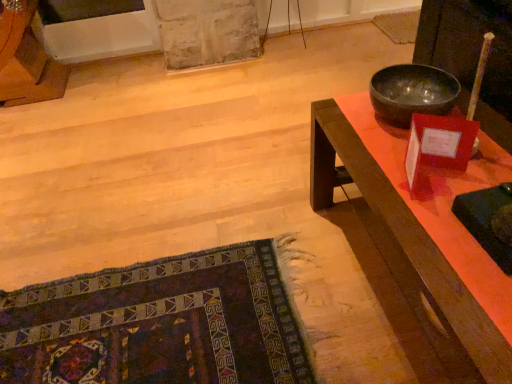
Question: Is dark woven rug at lower left not inside shiny metallic bowl at upper right?

Choices:
 (A) yes
 (B) no

Answer: (A)

Question: Considering the relative sizes of dark woven rug at lower left and shiny metallic bowl at upper right in the image provided, is dark woven rug at lower left wider than shiny metallic bowl at upper right?

Choices:
 (A) no
 (B) yes

Answer: (B)

Question: Considering the relative sizes of dark woven rug at lower left and shiny metallic bowl at upper right in the image provided, is dark woven rug at lower left shorter than shiny metallic bowl at upper right?

Choices:
 (A) no
 (B) yes

Answer: (B)

Question: Is dark woven rug at lower left next to shiny metallic bowl at upper right and touching it?

Choices:
 (A) yes
 (B) no

Answer: (B)

Question: Is dark woven rug at lower left positioned behind shiny metallic bowl at upper right?

Choices:
 (A) yes
 (B) no

Answer: (B)

Question: In terms of height, does dark woven rug at lower left look taller or shorter compared to wooden desk at right?

Choices:
 (A) short
 (B) tall

Answer: (A)

Question: From the image's perspective, is dark woven rug at lower left above or below wooden desk at right?

Choices:
 (A) above
 (B) below

Answer: (B)

Question: Looking at the image, does dark woven rug at lower left seem bigger or smaller compared to wooden desk at right?

Choices:
 (A) big
 (B) small

Answer: (B)

Question: Considering their positions, is dark woven rug at lower left located in front of or behind wooden desk at right?

Choices:
 (A) behind
 (B) front

Answer: (A)

Question: From the image's perspective, is dark woven rug at lower left above or below shiny metallic bowl at upper right?

Choices:
 (A) above
 (B) below

Answer: (B)

Question: Is point (45, 316) positioned closer to the camera than point (441, 102)?

Choices:
 (A) farther
 (B) closer

Answer: (A)

Question: Considering the positions of dark woven rug at lower left and shiny metallic bowl at upper right in the image, is dark woven rug at lower left wider or thinner than shiny metallic bowl at upper right?

Choices:
 (A) thin
 (B) wide

Answer: (B)

Question: Is dark woven rug at lower left situated inside shiny metallic bowl at upper right or outside?

Choices:
 (A) inside
 (B) outside

Answer: (B)

Question: From a real-world perspective, is wooden desk at right above or below dark woven rug at lower left?

Choices:
 (A) above
 (B) below

Answer: (A)

Question: Do you think wooden desk at right is within dark woven rug at lower left, or outside of it?

Choices:
 (A) inside
 (B) outside

Answer: (B)